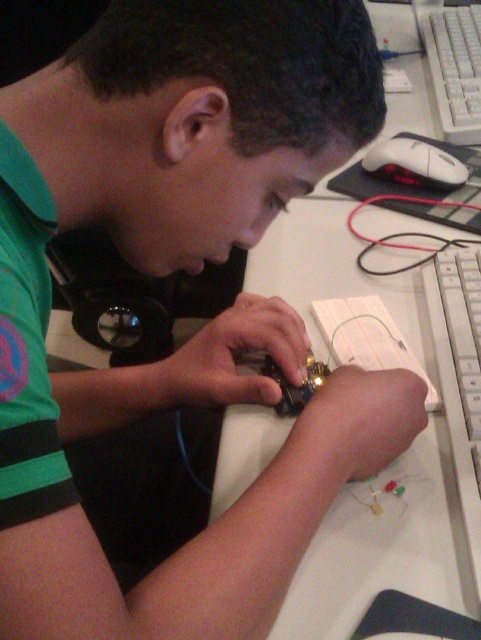
Is point (468, 490) farther from camera compared to point (473, 45)?

No.

What do you see at coordinates (459, 378) in the screenshot?
I see `white plastic keyboard at right` at bounding box center [459, 378].

You are a GUI agent. You are given a task and a screenshot of the screen. Output one action in this format:
    pyautogui.click(x=<x>, y=<y>)
    Task: Click on the white plastic keyboard at right
    The width and height of the screenshot is (481, 640).
    Given the screenshot: What is the action you would take?
    pyautogui.click(x=459, y=378)

Identify the location of white plastic keyboard at right. (459, 378).

Is white plastic keyboard at right smaller than metallic circuit board at center?

No, white plastic keyboard at right is not smaller than metallic circuit board at center.

Who is more forward, [461,445] or [307,362]?

Point [461,445]

I want to click on white plastic keyboard at right, so click(x=459, y=378).

Who is more distant from viewer, (459, 26) or (262, 360)?

The point (459, 26) is behind.

Find the location of a particular element. The width and height of the screenshot is (481, 640). white plastic keyboard at upper right is located at coordinates (455, 70).

Where is `white plastic keyboard at upper right`? white plastic keyboard at upper right is located at coordinates (455, 70).